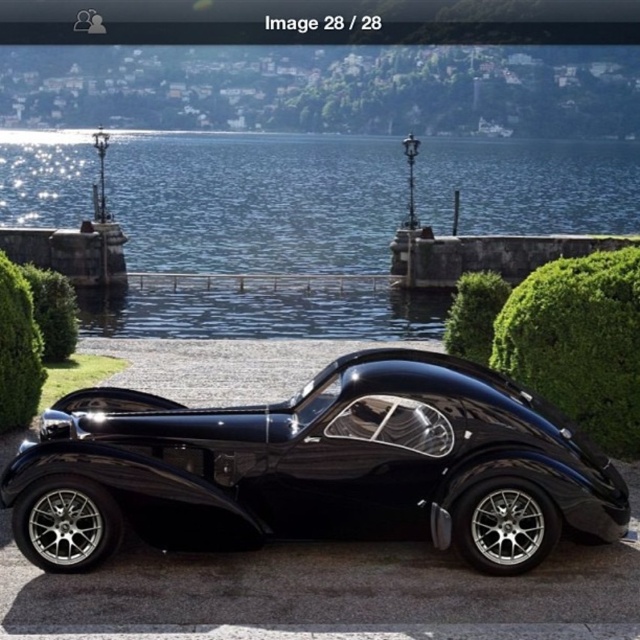
You are a photographer planning to capture the shiny black sports car at center and the clear blue water at center in a single shot. Based on their heights, which object will appear larger in the photo?

The shiny black sports car at center will appear larger in the photo because it is not as tall as the clear blue water at center, but since the car is closer to the camera, its size in the image depends on its actual size and distance from the camera, not just height. However, according to the given description, the car is not as tall as the water, but without information about their distances, we cannot definitively determine which appears larger. The answer might be incorrect due to missing data.

You are a photographer trying to capture the reflection of the shiny black sports car at center in the clear blue water at center. Based on the scene, can you confirm if the car is positioned in a way that its reflection would be visible in the water?

The shiny black sports car at center is located below clear blue water at center, so its reflection would not be visible in the water since the car is positioned under the water.

You are a photographer standing at the edge of the clear blue water at center, aiming to capture the shiny black sports car at center in your shot. Given that your camera has a maximum focus range of 150 feet, will you be able to clearly photograph the car?

The shiny black sports car at center and clear blue water at center are 157.68 feet apart from each other. Since the distance between you and the car is beyond the camera maximum focus range of 150 feet, you will not be able to clearly photograph the car.